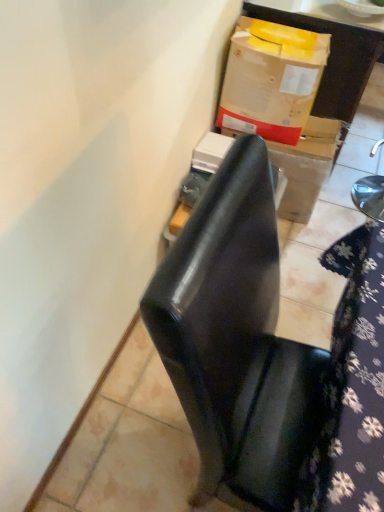
Question: Is cardboard box at upper right not within glossy black chair at center?

Choices:
 (A) no
 (B) yes

Answer: (B)

Question: From a real-world perspective, is cardboard box at upper right positioned under glossy black chair at center based on gravity?

Choices:
 (A) no
 (B) yes

Answer: (A)

Question: Does cardboard box at upper right appear on the left side of glossy black chair at center?

Choices:
 (A) no
 (B) yes

Answer: (B)

Question: From the image's perspective, is cardboard box at upper right on glossy black chair at center?

Choices:
 (A) no
 (B) yes

Answer: (B)

Question: Considering the relative sizes of cardboard box at upper right and glossy black chair at center in the image provided, is cardboard box at upper right bigger than glossy black chair at center?

Choices:
 (A) no
 (B) yes

Answer: (A)

Question: From their relative heights in the image, would you say glossy black chair at center is taller or shorter than cardboard box at upper right?

Choices:
 (A) short
 (B) tall

Answer: (B)

Question: Looking at the image, does glossy black chair at center seem bigger or smaller compared to cardboard box at upper right?

Choices:
 (A) big
 (B) small

Answer: (A)

Question: From the image's perspective, is glossy black chair at center positioned above or below cardboard box at upper right?

Choices:
 (A) above
 (B) below

Answer: (B)

Question: From a real-world perspective, is glossy black chair at center above or below cardboard box at upper right?

Choices:
 (A) below
 (B) above

Answer: (B)

Question: Is point (299, 74) closer or farther from the camera than point (357, 287)?

Choices:
 (A) farther
 (B) closer

Answer: (A)

Question: Is cardboard box at upper right situated inside floral fabric at lower right or outside?

Choices:
 (A) outside
 (B) inside

Answer: (A)

Question: From a real-world perspective, is cardboard box at upper right positioned above or below floral fabric at lower right?

Choices:
 (A) above
 (B) below

Answer: (A)

Question: Is cardboard box at upper right taller or shorter than floral fabric at lower right?

Choices:
 (A) tall
 (B) short

Answer: (B)

Question: Is cardboard box at upper right inside the boundaries of cardboard box at upper right, or outside?

Choices:
 (A) outside
 (B) inside

Answer: (A)

Question: Looking at the image, does cardboard box at upper right seem bigger or smaller compared to cardboard box at upper right?

Choices:
 (A) small
 (B) big

Answer: (B)